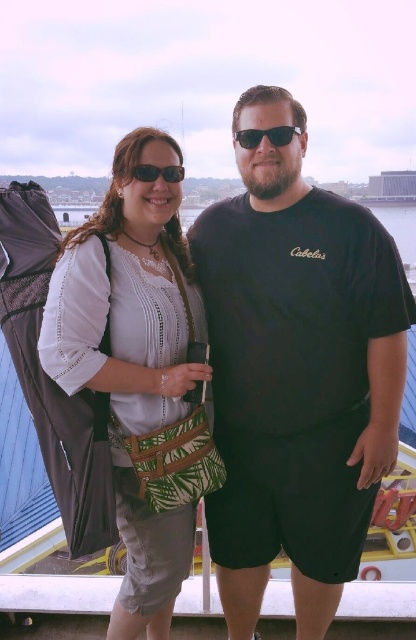
Question: Which point is closer to the camera?

Choices:
 (A) (349, 396)
 (B) (237, 141)

Answer: (A)

Question: Is green leafy fabric bag at left below matte black sunglasses at upper center?

Choices:
 (A) no
 (B) yes

Answer: (B)

Question: Which of the following is the farthest from the observer?

Choices:
 (A) black cotton t-shirt at center
 (B) matte black sunglasses at upper center
 (C) sunglasses at center
 (D) green leafy fabric bag at left

Answer: (B)

Question: Can you confirm if green leafy fabric bag at left is smaller than matte black sunglasses at upper center?

Choices:
 (A) no
 (B) yes

Answer: (A)

Question: Which of the following is the farthest from the observer?

Choices:
 (A) sunglasses at center
 (B) green leafy fabric bag at left

Answer: (A)

Question: Does green leafy fabric bag at left come behind matte black sunglasses at upper center?

Choices:
 (A) no
 (B) yes

Answer: (A)